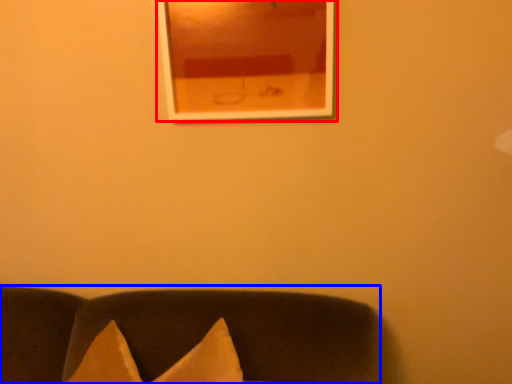
Question: Which object is closer to the camera taking this photo, picture frame (highlighted by a red box) or furniture (highlighted by a blue box)?

Choices:
 (A) picture frame
 (B) furniture

Answer: (B)